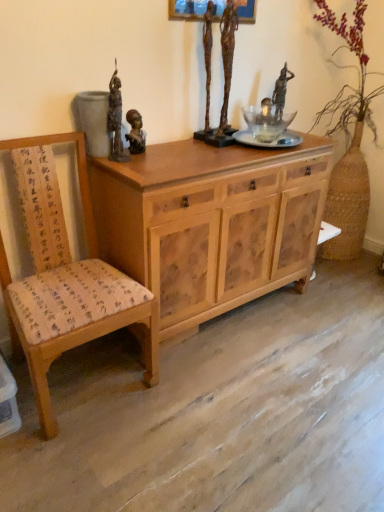
Question: Is bronze statue at center, which ranks as the 1th sculpture in right-to-left order, shorter than transparent glass vase at upper center, which is the second person in left-to-right order?

Choices:
 (A) no
 (B) yes

Answer: (A)

Question: Does bronze statue at center, which ranks as the 1th sculpture in right-to-left order, have a greater width compared to transparent glass vase at upper center, marked as the third person in a front-to-back arrangement?

Choices:
 (A) no
 (B) yes

Answer: (B)

Question: Is the depth of bronze statue at center, which ranks as the 1th sculpture in right-to-left order, greater than that of transparent glass vase at upper center, the first person from the back?

Choices:
 (A) yes
 (B) no

Answer: (B)

Question: Is bronze statue at center, the 2th sculpture in the left-to-right sequence, to the right of transparent glass vase at upper center, which appears as the 2th person when viewed from the right, from the viewer's perspective?

Choices:
 (A) yes
 (B) no

Answer: (B)

Question: From the image's perspective, is bronze statue at center, the 2th sculpture in the left-to-right sequence, over transparent glass vase at upper center, which is the second person in left-to-right order?

Choices:
 (A) no
 (B) yes

Answer: (B)

Question: In the image, is transparent glass vase at upper center, the first person from the back, positioned in front of or behind natural wood cabinet at center?

Choices:
 (A) behind
 (B) front

Answer: (A)

Question: Would you say transparent glass vase at upper center, the first person from the back, is inside or outside natural wood cabinet at center?

Choices:
 (A) inside
 (B) outside

Answer: (B)

Question: In terms of height, does transparent glass vase at upper center, the first person from the back, look taller or shorter compared to natural wood cabinet at center?

Choices:
 (A) tall
 (B) short

Answer: (B)

Question: Based on their positions, is transparent glass vase at upper center, the first person from the back, located to the left or right of natural wood cabinet at center?

Choices:
 (A) left
 (B) right

Answer: (B)

Question: From the image's perspective, is bronze statue at center, which ranks as the 1th sculpture in right-to-left order, located above or below bronze statue at upper center, which is the 1th person from right to left?

Choices:
 (A) above
 (B) below

Answer: (B)

Question: Considering the positions of bronze statue at center, which ranks as the 1th sculpture in right-to-left order, and bronze statue at upper center, which is the 1th person from right to left, in the image, is bronze statue at center, which ranks as the 1th sculpture in right-to-left order, taller or shorter than bronze statue at upper center, which is the 1th person from right to left,?

Choices:
 (A) tall
 (B) short

Answer: (A)

Question: Looking at the image, does bronze statue at center, the 2th sculpture in the left-to-right sequence, seem bigger or smaller compared to bronze statue at upper center, which is the 1th person from right to left?

Choices:
 (A) big
 (B) small

Answer: (A)

Question: Looking at their shapes, would you say bronze statue at center, the 2th sculpture in the left-to-right sequence, is wider or thinner than bronze statue at upper center, which is the 1th person from right to left?

Choices:
 (A) thin
 (B) wide

Answer: (B)

Question: From the image's perspective, relative to bronze statue at upper left, which is the first sculpture from left to right, is wooden chair with fabric cushion at left above or below?

Choices:
 (A) below
 (B) above

Answer: (A)

Question: Looking at the image, does wooden chair with fabric cushion at left seem bigger or smaller compared to bronze statue at upper left, which is the first sculpture from left to right?

Choices:
 (A) big
 (B) small

Answer: (A)